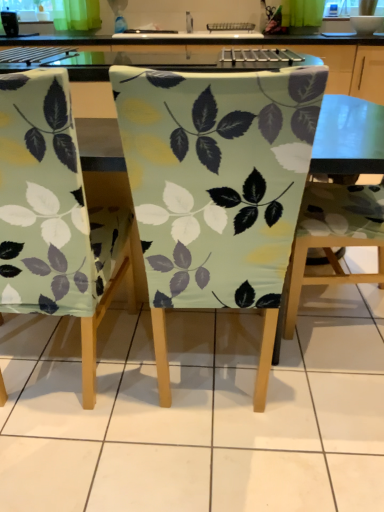
Question: In terms of height, does matte fabric chair at center, marked as the first chair in a right-to-left arrangement, look taller or shorter compared to matte fabric chair at center, which is the second chair from right to left?

Choices:
 (A) short
 (B) tall

Answer: (A)

Question: Is point (296, 306) closer or farther from the camera than point (157, 245)?

Choices:
 (A) closer
 (B) farther

Answer: (B)

Question: Which object is positioned closest to the matte fabric chair at center, which is counted as the 3th chair, starting from the left?

Choices:
 (A) matte green fabric chair at center, which ranks as the 1th chair in left-to-right order
 (B) matte fabric chair at center, the 2th chair when ordered from left to right

Answer: (B)

Question: Estimate the real-world distances between objects in this image. Which object is farther from the matte green fabric chair at center, which ranks as the 1th chair in left-to-right order?

Choices:
 (A) matte fabric chair at center, which is counted as the 3th chair, starting from the left
 (B) matte fabric chair at center, which is the second chair from right to left

Answer: (A)